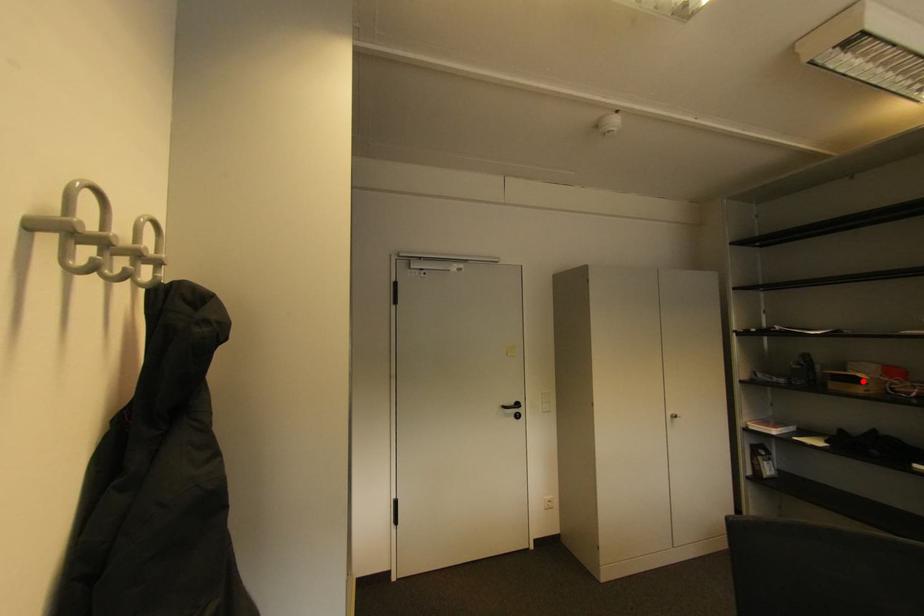
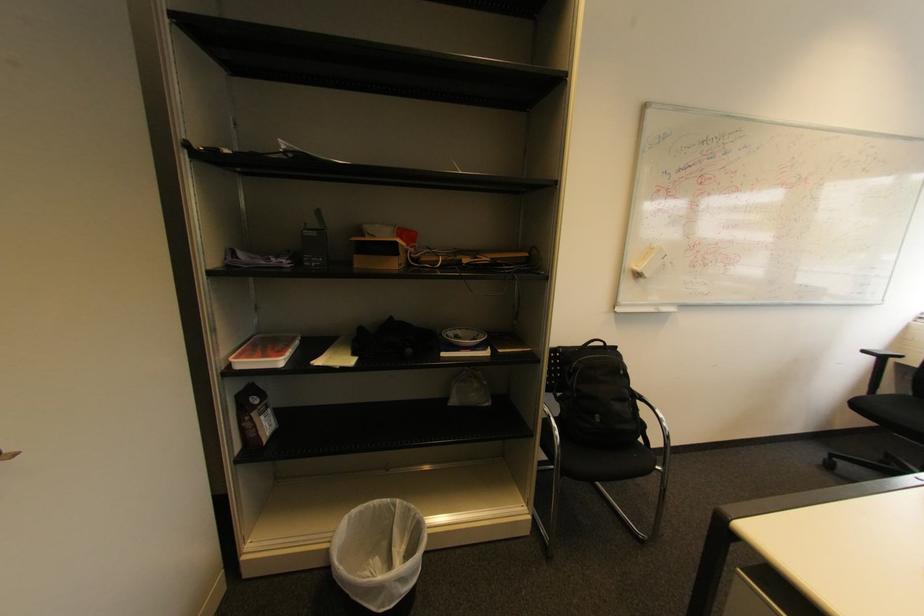
In the second image, find the point that corresponds to the highlighted location in the first image.

(395, 251)